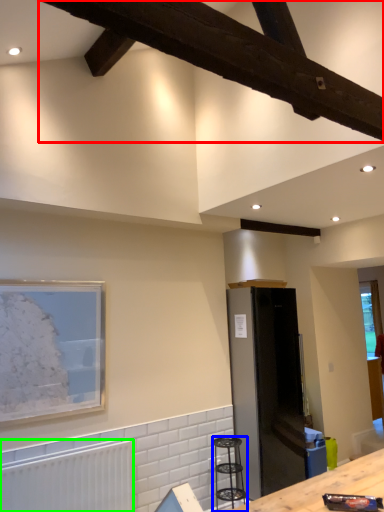
Question: Which object is the farthest from exhaust hood (highlighted by a red box)? Choose among these: bar stool (highlighted by a blue box) or radiator (highlighted by a green box).

Choices:
 (A) bar stool
 (B) radiator

Answer: (A)